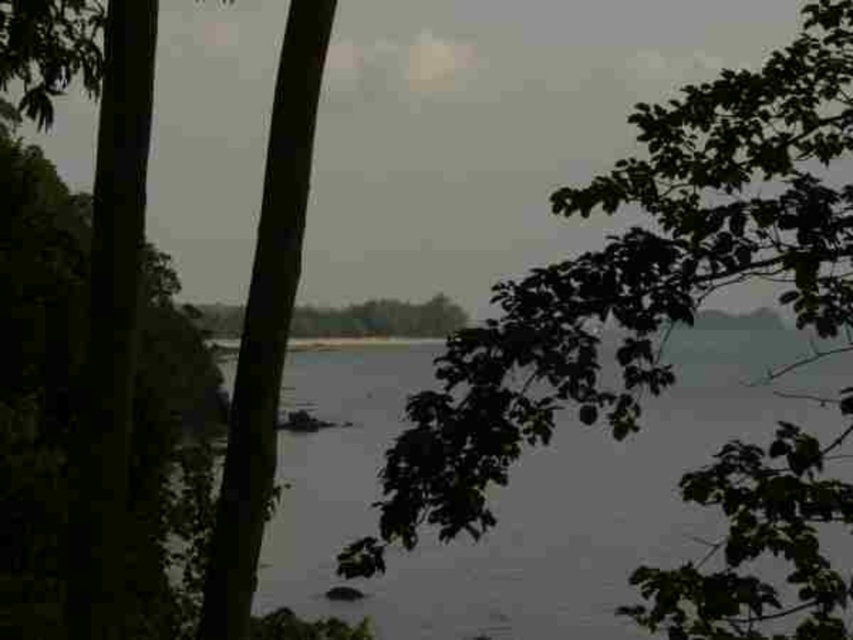
You are a photographer standing at the riverside. You want to capture a photo that includes both the green leafy tree at upper right and the clear water at center. Based on their positions, will the tree appear in front of or behind the water in the photo?

The green leafy tree at upper right is above clear water at center, so in the photo, the tree will appear in front of the water because it is positioned above it.

You are a photographer planning to capture the clear water at center and the green leafy tree at upper right in one frame. Based on their sizes, which object would appear smaller in the final photograph?

The green leafy tree at upper right would appear smaller in the final photograph because it is thinner than the clear water at center.